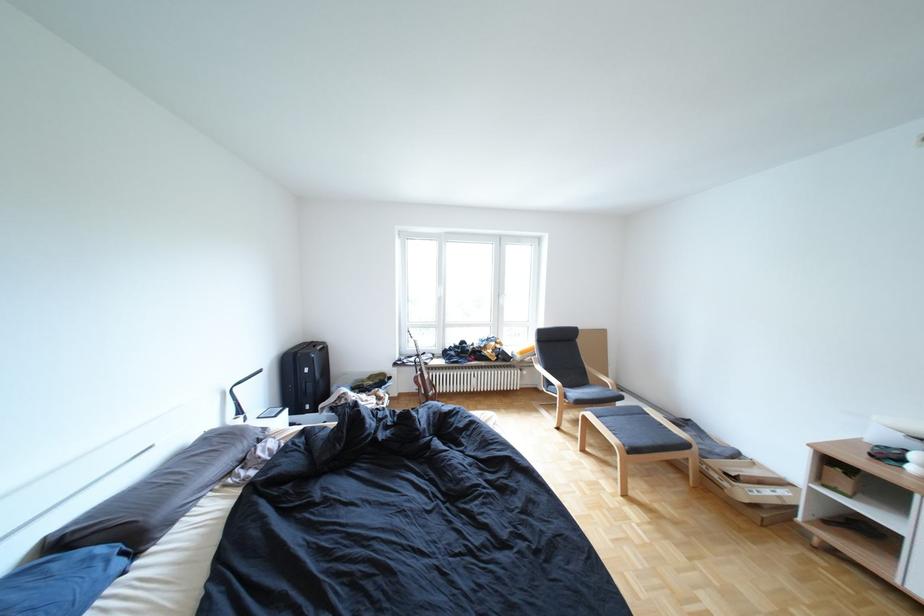
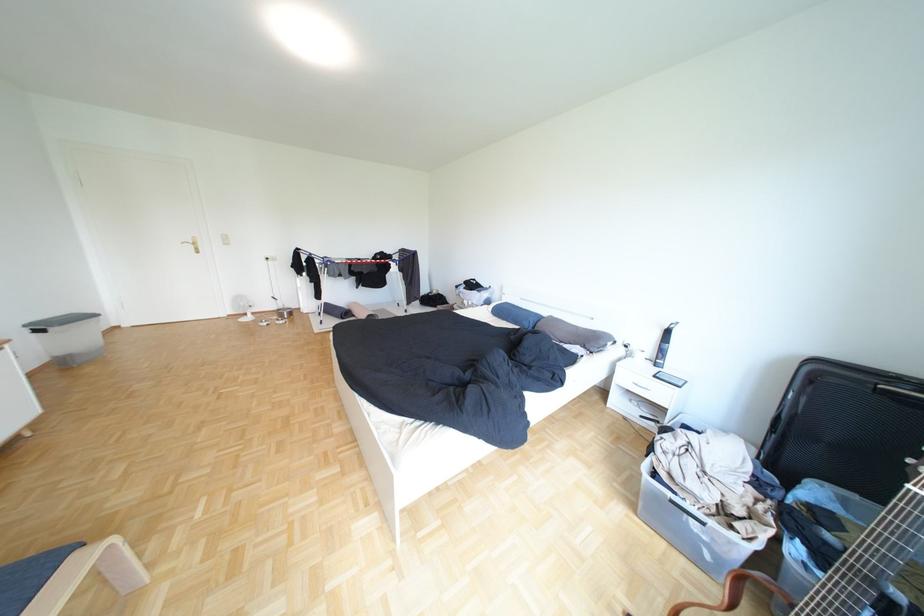
In the second image, find the point that corresponds to the point at 274,440 in the first image.

(600, 347)